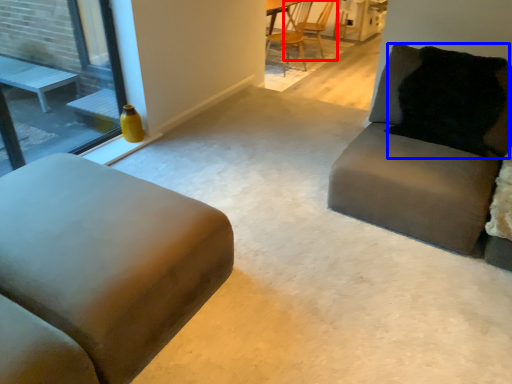
Question: Which point is closer to the camera, chair (highlighted by a red box) or pillow (highlighted by a blue box)?

Choices:
 (A) chair
 (B) pillow

Answer: (B)